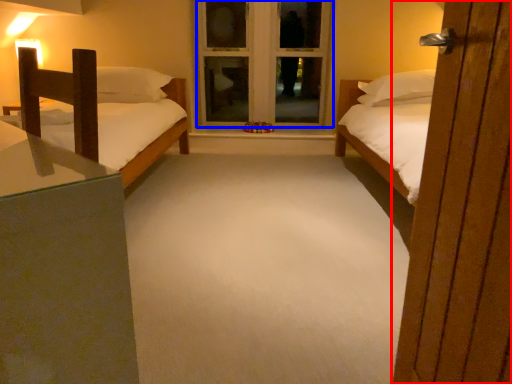
Question: Among these objects, which one is nearest to the camera, door (highlighted by a red box) or window frame (highlighted by a blue box)?

Choices:
 (A) door
 (B) window frame

Answer: (A)